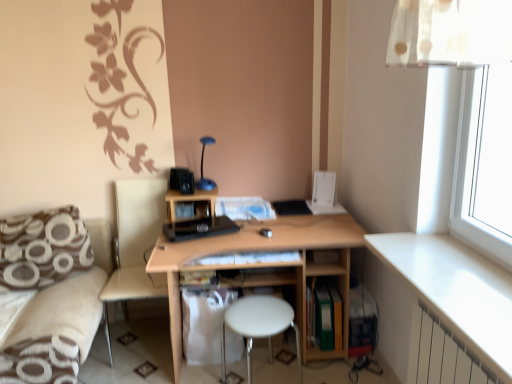
Locate an element on the screen. Image resolution: width=512 pixels, height=384 pixels. white paper at center, the 3th book positioned from the right is located at coordinates (244, 208).

The image size is (512, 384). What do you see at coordinates (442, 355) in the screenshot?
I see `white metallic radiator at lower right` at bounding box center [442, 355].

This screenshot has height=384, width=512. What do you see at coordinates (456, 290) in the screenshot?
I see `white glossy table at lower right` at bounding box center [456, 290].

What do you see at coordinates (198, 278) in the screenshot? I see `matte plastic book at center, which appears as the 2th book when viewed from the top` at bounding box center [198, 278].

Identify the location of white paper at center, the 3th book positioned from the right. (244, 208).

Based on the photo, looking at their sizes, would you say white metallic radiator at lower right is wider or thinner than white paper at center, the 4th book ordered from the bottom?

Clearly, white metallic radiator at lower right has less width compared to white paper at center, the 4th book ordered from the bottom.

Can you tell me how much white metallic radiator at lower right and white paper at center, which is counted as the 2th book, starting from the left, differ in facing direction?

They differ by 85 degrees in their facing directions.

Which point is more forward, (x=435, y=383) or (x=234, y=199)?

The point (x=435, y=383) is more forward.

Is white paper at center, the 3th book positioned from the right, located within white metallic radiator at lower right?

No, white metallic radiator at lower right does not contain white paper at center, the 3th book positioned from the right.

In the scene shown: Could you tell me if brown printed fabric pillow at lower left is facing light brown wooden desk at center?

No, brown printed fabric pillow at lower left is not facing towards light brown wooden desk at center.

Is brown printed fabric pillow at lower left not close to light brown wooden desk at center?

No, brown printed fabric pillow at lower left is in close proximity to light brown wooden desk at center.

How many degrees apart are the facing directions of brown printed fabric pillow at lower left and light brown wooden desk at center?

brown printed fabric pillow at lower left and light brown wooden desk at center are facing 2.52 degrees away from each other.

Where is `desk below the brown printed fabric pillow at lower left (from the image's perspective)`? desk below the brown printed fabric pillow at lower left (from the image's perspective) is located at coordinates coord(266,266).

This screenshot has width=512, height=384. What are the coordinates of `couch in front of the blue glossy table lamp at upper center` in the screenshot? It's located at (54, 331).

Is beige fabric couch at left to the right of blue glossy table lamp at upper center from the viewer's perspective?

Incorrect, beige fabric couch at left is not on the right side of blue glossy table lamp at upper center.

From a real-world perspective, is beige fabric couch at left physically located above or below blue glossy table lamp at upper center?

From a real-world perspective, beige fabric couch at left is physically below blue glossy table lamp at upper center.

Which of these two, beige fabric couch at left or blue glossy table lamp at upper center, is wider?

Wider between the two is beige fabric couch at left.

Which of these two, beige fabric swivel chair at lower left or white glossy table at lower right, stands taller?

Standing taller between the two is beige fabric swivel chair at lower left.

Is point (145, 253) less distant than point (452, 304)?

No, (145, 253) is behind (452, 304).

Which object is thinner, beige fabric swivel chair at lower left or white glossy table at lower right?

With smaller width is white glossy table at lower right.

Is beige fabric swivel chair at lower left oriented towards white glossy table at lower right?

No, beige fabric swivel chair at lower left is not facing towards white glossy table at lower right.

Is matte plastic book at center, the 3th book from the bottom, oriented away from white paper at center, placed as the 1th book when sorted from top to bottom?

No, matte plastic book at center, the 3th book from the bottom, is not facing away from white paper at center, placed as the 1th book when sorted from top to bottom.

Between matte plastic book at center, the 3th book from the bottom, and white paper at center, the 4th book ordered from the bottom, which one is positioned behind?

white paper at center, the 4th book ordered from the bottom, is further away from the camera.

Which of these two, matte plastic book at center, which appears as the 2th book when viewed from the top, or white paper at center, the 3th book positioned from the right, is bigger?

white paper at center, the 3th book positioned from the right, is bigger.

Can you confirm if matte plastic book at center, the 3th book from the bottom, is positioned to the right of white paper at center, the 4th book ordered from the bottom?

In fact, matte plastic book at center, the 3th book from the bottom, is to the left of white paper at center, the 4th book ordered from the bottom.

From a real-world perspective, relative to light brown wooden desk at center, is white glossy table at lower right vertically above or below?

In terms of real-world spatial position, white glossy table at lower right is above light brown wooden desk at center.

Between white glossy table at lower right and light brown wooden desk at center, which one has smaller size?

Smaller between the two is white glossy table at lower right.

Is white glossy table at lower right thinner than light brown wooden desk at center?

Indeed, white glossy table at lower right has a lesser width compared to light brown wooden desk at center.

Is light brown wooden desk at center at the back of white glossy table at lower right?

white glossy table at lower right does not have its back to light brown wooden desk at center.

From the image's perspective, relative to white paper at center, which is counted as the 2th book, starting from the left, is beige fabric swivel chair at lower left above or below?

From the image's perspective, beige fabric swivel chair at lower left appears below white paper at center, which is counted as the 2th book, starting from the left.

Considering the sizes of beige fabric swivel chair at lower left and white paper at center, the 4th book ordered from the bottom, in the image, is beige fabric swivel chair at lower left taller or shorter than white paper at center, the 4th book ordered from the bottom,?

Clearly, beige fabric swivel chair at lower left is taller compared to white paper at center, the 4th book ordered from the bottom.

Is beige fabric swivel chair at lower left next to white paper at center, the 4th book ordered from the bottom?

beige fabric swivel chair at lower left and white paper at center, the 4th book ordered from the bottom, are not in contact.

Based on the photo, do you think beige fabric swivel chair at lower left is within white paper at center, the 3th book positioned from the right, or outside of it?

beige fabric swivel chair at lower left lies outside white paper at center, the 3th book positioned from the right.

In order to click on book above the white metallic radiator at lower right (from a real-world perspective) in this screenshot , I will do `click(244, 208)`.

Where is `pillow on the left of light brown wooden desk at center`? The height and width of the screenshot is (384, 512). pillow on the left of light brown wooden desk at center is located at coordinates (42, 248).

Which object lies nearer to the anchor point green matte folder at lower center, the first book from the right, matte plastic book at center, which appears as the 2th book when viewed from the top, or white paper at center, the 4th book ordered from the bottom?

Among the two, white paper at center, the 4th book ordered from the bottom, is located nearer to green matte folder at lower center, the first book from the right.

Based on their spatial positions, is white paper at center, which is counted as the 2th book, starting from the left, or green matte folder at lower right, which ranks as the 2th book in right-to-left order, closer to matte plastic book at center, the fourth book positioned from the right?

Among the two, white paper at center, which is counted as the 2th book, starting from the left, is located nearer to matte plastic book at center, the fourth book positioned from the right.

When comparing their distances from matte plastic book at center, arranged as the 1th book when viewed from the left, does blue glossy table lamp at upper center or white plastic stool at center seem further?

The object further to matte plastic book at center, arranged as the 1th book when viewed from the left, is blue glossy table lamp at upper center.

When comparing their distances from white glossy table at lower right, does matte plastic book at center, which appears as the 2th book when viewed from the top, or white metallic radiator at lower right seem further?

matte plastic book at center, which appears as the 2th book when viewed from the top, is further to white glossy table at lower right.

Estimate the real-world distances between objects in this image. Which object is further from beige fabric swivel chair at lower left, green matte folder at lower center, arranged as the fourth book when viewed from the left, or white paper at center, the 3th book positioned from the right?

green matte folder at lower center, arranged as the fourth book when viewed from the left.

When comparing their distances from white metallic radiator at lower right, does beige fabric swivel chair at lower left or brown printed fabric pillow at lower left seem closer?

beige fabric swivel chair at lower left lies closer to white metallic radiator at lower right than the other object.

Which object lies nearer to the anchor point white paper at center, the 4th book ordered from the bottom, matte plastic book at center, which appears as the 2th book when viewed from the top, or green matte folder at lower right, which is the first book from bottom to top?

Based on the image, matte plastic book at center, which appears as the 2th book when viewed from the top, appears to be nearer to white paper at center, the 4th book ordered from the bottom.

Which object lies further to the anchor point matte plastic book at center, arranged as the 1th book when viewed from the left, white metallic radiator at lower right or beige fabric couch at left?

white metallic radiator at lower right is further to matte plastic book at center, arranged as the 1th book when viewed from the left.

Locate an element on the screen. This screenshot has width=512, height=384. swivel chair situated between brown printed fabric pillow at lower left and green matte folder at lower right, which ranks as the 2th book in right-to-left order, from left to right is located at coordinates (135, 244).

Identify the location of swivel chair between brown printed fabric pillow at lower left and white plastic stool at center from left to right. [135, 244].

Locate an element on the screen. desk between white glossy table at lower right and white plastic stool at center in the front-back direction is located at coordinates [x=266, y=266].

Find the location of a particular element. This screenshot has height=384, width=512. desk situated between beige fabric couch at left and white metallic radiator at lower right from left to right is located at coordinates (266, 266).